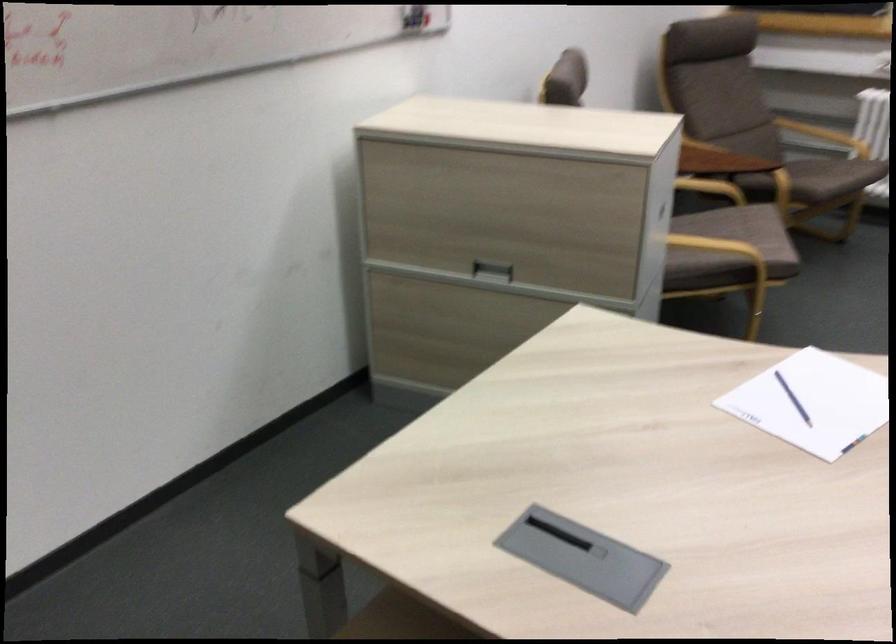
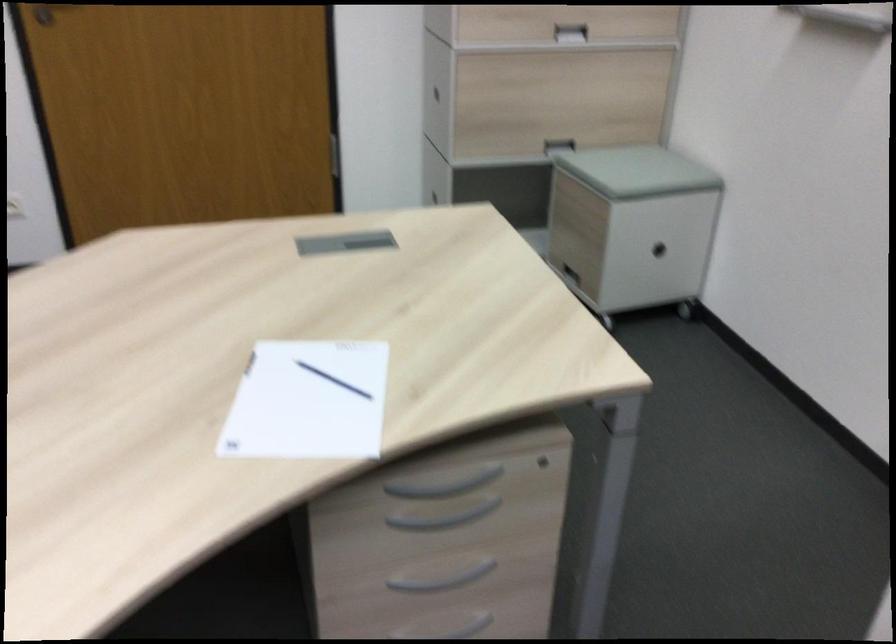
Find the pixel in the second image that matches pixel 814 411 in the first image.

(307, 402)